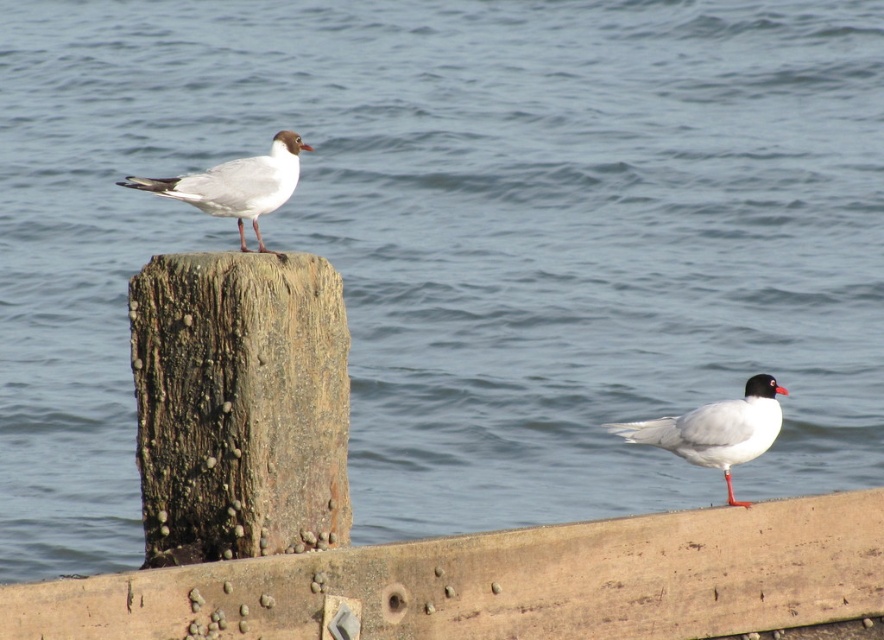
Is the position of weathered wood dock at lower center less distant than that of white matte bird at lower right?

Yes, it is.

Is weathered wood dock at lower center shorter than white matte bird at lower right?

No, weathered wood dock at lower center is not shorter than white matte bird at lower right.

The image size is (884, 640). Describe the element at coordinates (507, 582) in the screenshot. I see `weathered wood dock at lower center` at that location.

Find the location of a particular element. This screenshot has height=640, width=884. weathered wood dock at lower center is located at coordinates (507, 582).

Is weathered wood post at center to the right of white matte bird at lower right from the viewer's perspective?

Incorrect, weathered wood post at center is not on the right side of white matte bird at lower right.

Is point (153, 387) positioned in front of point (715, 440)?

Yes.

The image size is (884, 640). Describe the element at coordinates (239, 404) in the screenshot. I see `weathered wood post at center` at that location.

At what (x,y) coordinates should I click in order to perform the action: click on weathered wood post at center. Please return your answer as a coordinate pair (x, y). Looking at the image, I should click on (239, 404).

Is weathered wood dock at lower center bigger than weathered wood post at center?

Yes, weathered wood dock at lower center is bigger than weathered wood post at center.

Does point (420, 604) lie behind point (273, 540)?

No, it is not.

Identify the location of weathered wood dock at lower center. The width and height of the screenshot is (884, 640). (507, 582).